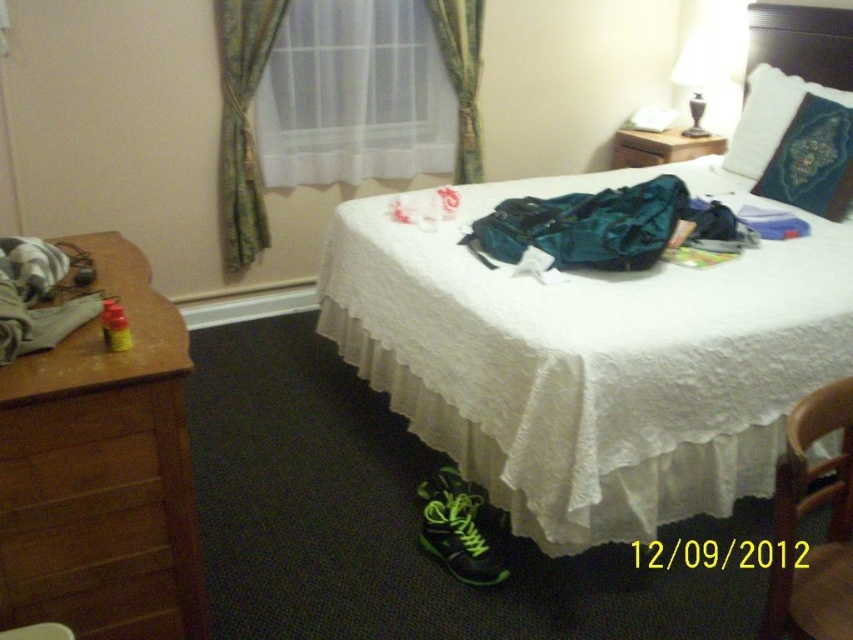
Question: Does brown wooden chair at lower right come behind brown wood nightstand at upper right?

Choices:
 (A) yes
 (B) no

Answer: (B)

Question: Which of the following is the farthest from the observer?

Choices:
 (A) [x=784, y=189]
 (B) [x=380, y=214]
 (C) [x=216, y=17]
 (D) [x=619, y=156]

Answer: (D)

Question: Is white sheer curtain at upper center closer to the viewer compared to green floral fabric curtain at upper left?

Choices:
 (A) yes
 (B) no

Answer: (B)

Question: Where is green velvet pillow at upper right located in relation to wooden drawer at upper right in the image?

Choices:
 (A) below
 (B) above

Answer: (A)

Question: Which of these objects is positioned closest to the white soft pillow at upper right?

Choices:
 (A) brown wooden chair at lower right
 (B) brown wood dresser at left
 (C) green floral fabric curtain at upper center
 (D) brown wood nightstand at upper right

Answer: (D)

Question: Which point is closer to the camera?

Choices:
 (A) green velvet pillow at upper right
 (B) white sheer curtain at upper center
 (C) brown wooden chair at lower right
 (D) brown wood dresser at left

Answer: (C)